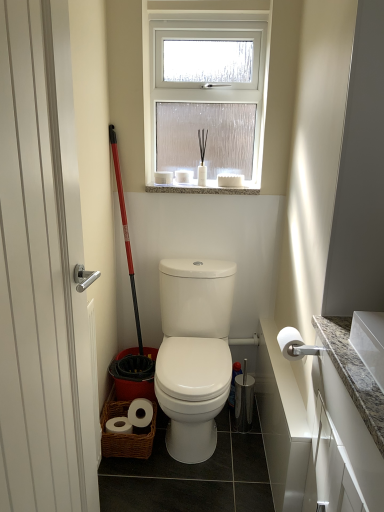
Question: Is white matte toilet paper at right touching red plastic ski pole at left?

Choices:
 (A) no
 (B) yes

Answer: (A)

Question: Is red plastic ski pole at left a part of white matte toilet paper at right?

Choices:
 (A) no
 (B) yes

Answer: (A)

Question: From a real-world perspective, is white matte toilet paper at right physically below red plastic ski pole at left?

Choices:
 (A) no
 (B) yes

Answer: (B)

Question: Can we say white matte toilet paper at right lies outside red plastic ski pole at left?

Choices:
 (A) no
 (B) yes

Answer: (B)

Question: Is white matte toilet paper at right shorter than red plastic ski pole at left?

Choices:
 (A) no
 (B) yes

Answer: (B)

Question: Is white matte toilet paper at right turned away from red plastic ski pole at left?

Choices:
 (A) no
 (B) yes

Answer: (A)

Question: Is granite at upper center at the right side of white matte toilet paper at right?

Choices:
 (A) no
 (B) yes

Answer: (A)

Question: Can you confirm if granite at upper center is bigger than white matte toilet paper at right?

Choices:
 (A) no
 (B) yes

Answer: (B)

Question: Considering the relative sizes of granite at upper center and white matte toilet paper at right in the image provided, is granite at upper center smaller than white matte toilet paper at right?

Choices:
 (A) no
 (B) yes

Answer: (A)

Question: From a real-world perspective, is granite at upper center positioned under white matte toilet paper at right based on gravity?

Choices:
 (A) no
 (B) yes

Answer: (A)

Question: Does granite at upper center have a greater height compared to white matte toilet paper at right?

Choices:
 (A) no
 (B) yes

Answer: (A)

Question: From the image's perspective, does granite at upper center appear higher than white matte toilet paper at right?

Choices:
 (A) no
 (B) yes

Answer: (B)

Question: Does white matte toilet paper at right have a greater width compared to white granite countertop at right?

Choices:
 (A) no
 (B) yes

Answer: (A)